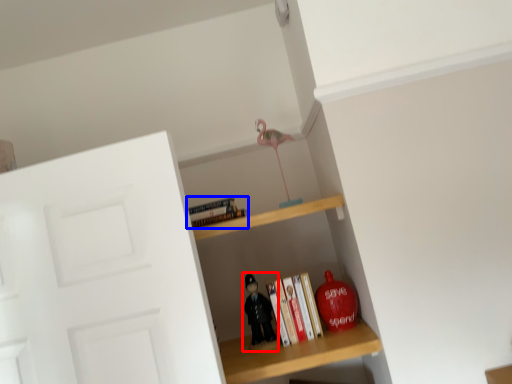
Question: Which object is closer to the camera taking this photo, toy (highlighted by a red box) or book (highlighted by a blue box)?

Choices:
 (A) toy
 (B) book

Answer: (B)